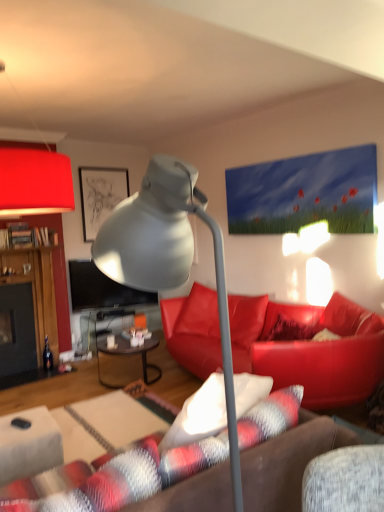
Image resolution: width=384 pixels, height=512 pixels. What do you see at coordinates (35, 183) in the screenshot?
I see `matte red lampshade at upper left, the second lamp in the front-to-back sequence` at bounding box center [35, 183].

Image resolution: width=384 pixels, height=512 pixels. I want to click on black glass table at center, acting as the first table starting from the back, so click(130, 355).

Image resolution: width=384 pixels, height=512 pixels. What do you see at coordinates (305, 353) in the screenshot?
I see `leather couch at center` at bounding box center [305, 353].

You are a GUI agent. You are given a task and a screenshot of the screen. Output one action in this format:
    pyautogui.click(x=<x>, y=<y>)
    Task: Click on the white fabric table at lower left, which is the first table in front-to-back order
    The width and height of the screenshot is (384, 512).
    Given the screenshot: What is the action you would take?
    pyautogui.click(x=29, y=445)

Looking at the image, does leather couch at center seem bigger or smaller compared to black rubberized corded phone at lower left?

Considering their sizes, leather couch at center takes up more space than black rubberized corded phone at lower left.

Can you tell me how much leather couch at center and black rubberized corded phone at lower left differ in facing direction?

They differ by 61.6 degrees in their facing directions.

From their relative heights in the image, would you say leather couch at center is taller or shorter than black rubberized corded phone at lower left?

Considering their sizes, leather couch at center has more height than black rubberized corded phone at lower left.

Is leather couch at center not within black rubberized corded phone at lower left?

Absolutely, leather couch at center is external to black rubberized corded phone at lower left.

I want to click on studio couch located behind the matte red lampshade at upper left, marked as the second lamp in a bottom-to-top arrangement, so click(305, 353).

Is leather couch at center inside or outside of matte red lampshade at upper left, marked as the second lamp in a bottom-to-top arrangement?

leather couch at center is outside matte red lampshade at upper left, marked as the second lamp in a bottom-to-top arrangement.

Relative to matte red lampshade at upper left, marked as the 1th lamp in a left-to-right arrangement, is leather couch at center in front or behind?

In the image, leather couch at center appears behind matte red lampshade at upper left, marked as the 1th lamp in a left-to-right arrangement.

From the image's perspective, between leather couch at center and matte red lampshade at upper left, the 1th lamp viewed from the top, which one is located above?

matte red lampshade at upper left, the 1th lamp viewed from the top, is shown above in the image.

From the white fabric table at lower left, the 2th table positioned from the back, count 2nd lamps forward and point to it. Please provide its 2D coordinates.

[(168, 257)]

Which is nearer, (x=15, y=443) or (x=178, y=161)?

The point (x=178, y=161) is closer to the camera.

In terms of width, does white fabric table at lower left, the 2th table positioned from the back, look wider or thinner when compared to matte gray lamp at center, positioned as the second lamp in back-to-front order?

Clearly, white fabric table at lower left, the 2th table positioned from the back, has less width compared to matte gray lamp at center, positioned as the second lamp in back-to-front order.

Between white fabric table at lower left, which is the first table in front-to-back order, and matte gray lamp at center, positioned as the second lamp in back-to-front order, which one has smaller size?

With smaller size is white fabric table at lower left, which is the first table in front-to-back order.

Between matte black picture frame at upper left and matte red lampshade at upper left, marked as the second lamp in a bottom-to-top arrangement, which one has smaller size?

matte black picture frame at upper left.

Can you confirm if matte black picture frame at upper left is wider than matte red lampshade at upper left, positioned as the second lamp in right-to-left order?

No, matte black picture frame at upper left is not wider than matte red lampshade at upper left, positioned as the second lamp in right-to-left order.

Who is taller, matte black picture frame at upper left or matte red lampshade at upper left, marked as the 1th lamp in a left-to-right arrangement?

With more height is matte black picture frame at upper left.

Is matte black picture frame at upper left oriented away from matte red lampshade at upper left, the second lamp in the front-to-back sequence?

matte black picture frame at upper left does not have its back to matte red lampshade at upper left, the second lamp in the front-to-back sequence.

Can you confirm if black rubberized corded phone at lower left is taller than matte gray lamp at center, the first lamp in the front-to-back sequence?

No, black rubberized corded phone at lower left is not taller than matte gray lamp at center, the first lamp in the front-to-back sequence.

From the image's perspective, is black rubberized corded phone at lower left beneath matte gray lamp at center, the first lamp when ordered from bottom to top?

Yes, from the image's perspective, black rubberized corded phone at lower left is beneath matte gray lamp at center, the first lamp when ordered from bottom to top.

Is black rubberized corded phone at lower left in front of or behind matte gray lamp at center, acting as the 1th lamp starting from the right, in the image?

black rubberized corded phone at lower left is behind matte gray lamp at center, acting as the 1th lamp starting from the right.

Is white fabric table at lower left, the 2th table positioned from the back, to the right of matte black picture frame at upper left from the viewer's perspective?

Yes.

Is point (50, 441) closer or farther from the camera than point (104, 185)?

Point (50, 441) is closer to the camera than point (104, 185).

Looking at this image, which of these two, white fabric table at lower left, the 2th table positioned from the back, or matte black picture frame at upper left, is wider?

white fabric table at lower left, the 2th table positioned from the back, is wider.

Which object is further away from the camera taking this photo, white fabric table at lower left, the 2th table positioned from the back, or matte red lampshade at upper left, the second lamp in the front-to-back sequence?

white fabric table at lower left, the 2th table positioned from the back, is more distant.

Does white fabric table at lower left, which is the first table in front-to-back order, turn towards matte red lampshade at upper left, positioned as the second lamp in right-to-left order?

No, white fabric table at lower left, which is the first table in front-to-back order, is not aimed at matte red lampshade at upper left, positioned as the second lamp in right-to-left order.

Which is in front, point (28, 463) or point (19, 179)?

The point (28, 463) is closer to the camera.

Which is more to the right, white fabric table at lower left, which is the first table in front-to-back order, or matte red lampshade at upper left, the second lamp in the front-to-back sequence?

white fabric table at lower left, which is the first table in front-to-back order, is more to the right.

Image resolution: width=384 pixels, height=512 pixels. In order to click on studio couch above the black rubberized corded phone at lower left (from a real-world perspective) in this screenshot , I will do `click(305, 353)`.

In order to click on lamp that is the 2nd one when counting leftward from the leather couch at center in this screenshot , I will do `click(35, 183)`.

From the image, which object appears to be nearer to white fabric table at lower left, the 2th table positioned from the back, matte gray lamp at center, the first lamp in the front-to-back sequence, or leather couch at center?

The object closer to white fabric table at lower left, the 2th table positioned from the back, is matte gray lamp at center, the first lamp in the front-to-back sequence.

From the image, which object appears to be farther from leather couch at center, matte black picture frame at upper left or black glass table at center, acting as the first table starting from the back?

matte black picture frame at upper left is positioned further to the anchor leather couch at center.

Estimate the real-world distances between objects in this image. Which object is closer to black glass table at center, the 2th table from the front, white fabric table at lower left, the 2th table positioned from the back, or matte black picture frame at upper left?

white fabric table at lower left, the 2th table positioned from the back, lies closer to black glass table at center, the 2th table from the front, than the other object.

Looking at the image, which one is located closer to matte red lampshade at upper left, marked as the second lamp in a bottom-to-top arrangement, black rubberized corded phone at lower left or black glass table at center, acting as the first table starting from the back?

The object closer to matte red lampshade at upper left, marked as the second lamp in a bottom-to-top arrangement, is black rubberized corded phone at lower left.

Based on their spatial positions, is matte red lampshade at upper left, marked as the second lamp in a bottom-to-top arrangement, or leather couch at center closer to matte black picture frame at upper left?

leather couch at center is positioned closer to the anchor matte black picture frame at upper left.

When comparing their distances from matte gray lamp at center, the first lamp in the front-to-back sequence, does matte black picture frame at upper left or white fabric table at lower left, the 2th table positioned from the back, seem closer?

The object closer to matte gray lamp at center, the first lamp in the front-to-back sequence, is white fabric table at lower left, the 2th table positioned from the back.

When comparing their distances from black rubberized corded phone at lower left, does matte red lampshade at upper left, marked as the 1th lamp in a left-to-right arrangement, or matte black picture frame at upper left seem closer?

The object closer to black rubberized corded phone at lower left is matte red lampshade at upper left, marked as the 1th lamp in a left-to-right arrangement.

From the image, which object appears to be nearer to matte gray lamp at center, the first lamp when ordered from bottom to top, matte black picture frame at upper left or leather couch at center?

leather couch at center is closer to matte gray lamp at center, the first lamp when ordered from bottom to top.

This screenshot has width=384, height=512. I want to click on studio couch between matte red lampshade at upper left, marked as the 1th lamp in a left-to-right arrangement, and white fabric table at lower left, which is the first table in front-to-back order, in the vertical direction, so click(x=305, y=353).

Identify the location of lamp between matte red lampshade at upper left, marked as the second lamp in a bottom-to-top arrangement, and white fabric table at lower left, which is the first table in front-to-back order, in the up-down direction. (168, 257).

Where is `table positioned between leather couch at center and matte black picture frame at upper left from near to far`? Image resolution: width=384 pixels, height=512 pixels. table positioned between leather couch at center and matte black picture frame at upper left from near to far is located at coordinates (130, 355).

Locate an element on the screen. This screenshot has width=384, height=512. corded phone positioned between matte red lampshade at upper left, the 1th lamp viewed from the top, and matte black picture frame at upper left from near to far is located at coordinates (21, 423).